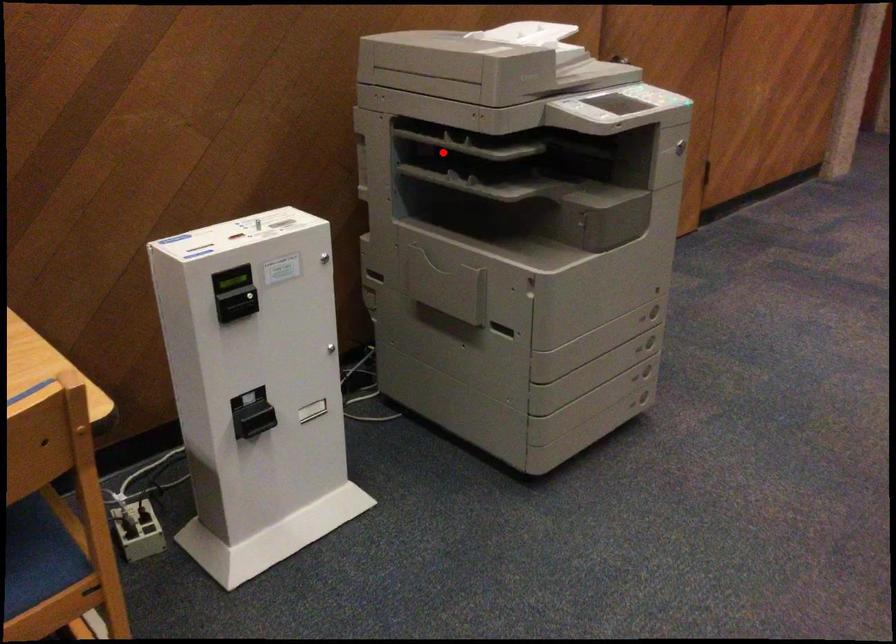
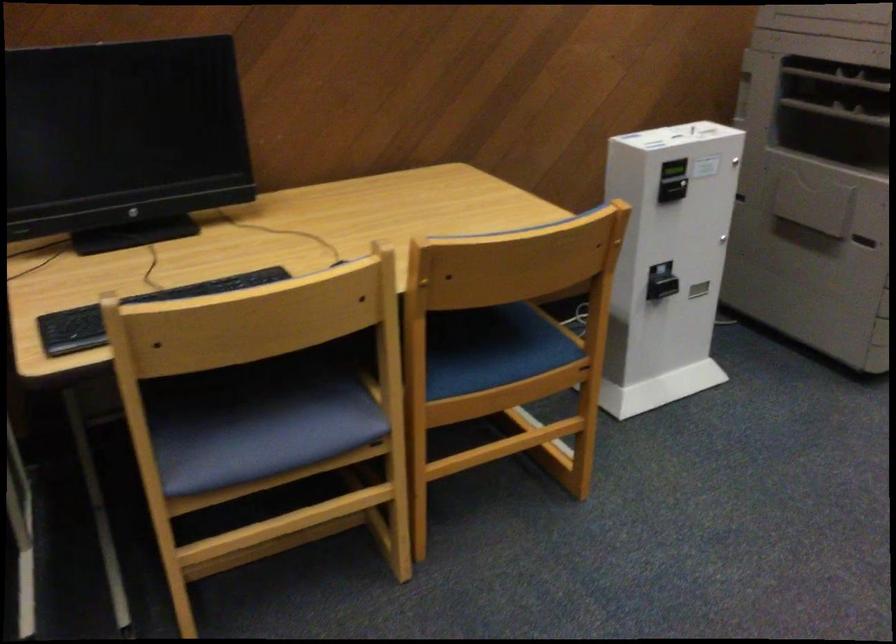
The point at the highlighted location is marked in the first image. Where is the corresponding point in the second image?

(839, 79)